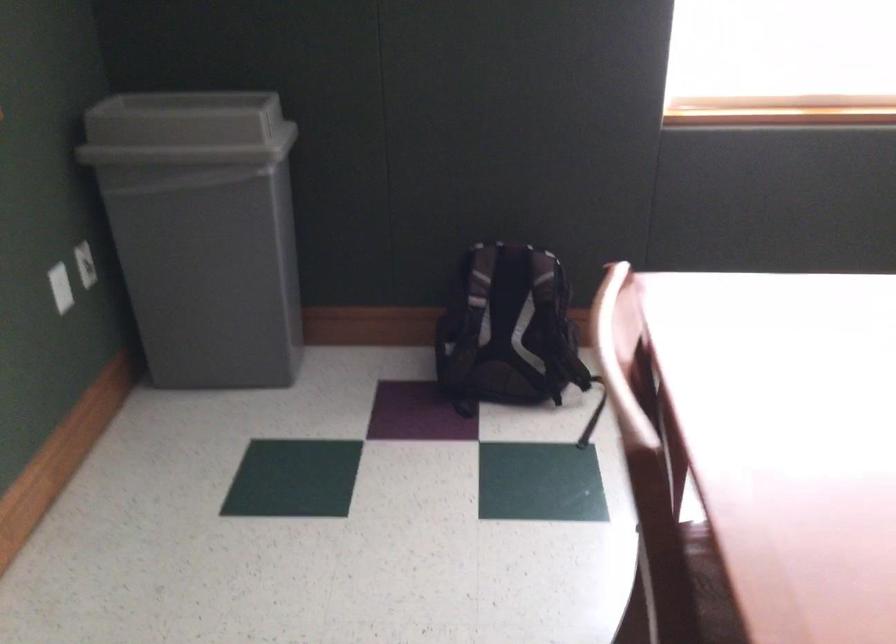
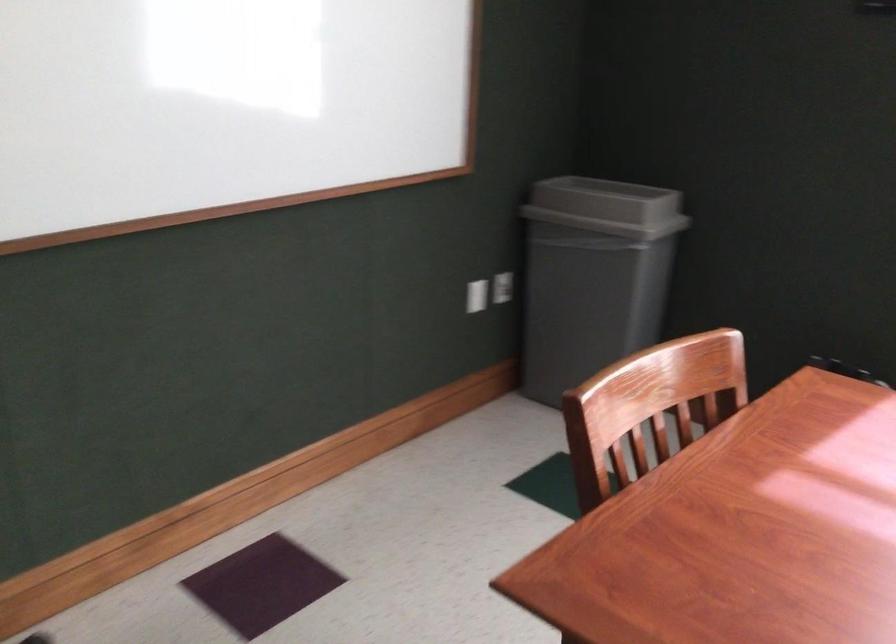
Where in the second image is the point corresponding to point 91,263 from the first image?

(503, 287)